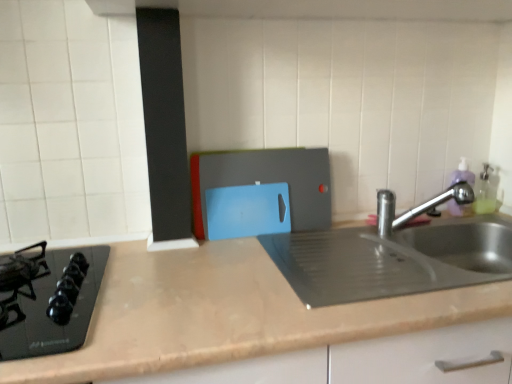
Question: Does blue plastic cutting board at center lie in front of black glass gas stove at left?

Choices:
 (A) no
 (B) yes

Answer: (A)

Question: From the image's perspective, does blue plastic cutting board at center appear higher than black glass gas stove at left?

Choices:
 (A) yes
 (B) no

Answer: (A)

Question: Is blue plastic cutting board at center not inside black glass gas stove at left?

Choices:
 (A) no
 (B) yes

Answer: (B)

Question: Is blue plastic cutting board at center smaller than black glass gas stove at left?

Choices:
 (A) yes
 (B) no

Answer: (A)

Question: Considering the relative sizes of blue plastic cutting board at center and black glass gas stove at left in the image provided, is blue plastic cutting board at center taller than black glass gas stove at left?

Choices:
 (A) no
 (B) yes

Answer: (B)

Question: In the image, is blue plastic cutting board at center positioned in front of or behind satin nickel faucet at right?

Choices:
 (A) behind
 (B) front

Answer: (A)

Question: From the image's perspective, is blue plastic cutting board at center positioned above or below satin nickel faucet at right?

Choices:
 (A) above
 (B) below

Answer: (A)

Question: Based on their positions, is blue plastic cutting board at center located to the left or right of satin nickel faucet at right?

Choices:
 (A) left
 (B) right

Answer: (A)

Question: Is blue plastic cutting board at center taller or shorter than satin nickel faucet at right?

Choices:
 (A) tall
 (B) short

Answer: (A)

Question: Does point (392, 195) appear closer or farther from the camera than point (14, 327)?

Choices:
 (A) farther
 (B) closer

Answer: (A)

Question: From their relative heights in the image, would you say satin nickel faucet at right is taller or shorter than black glass gas stove at left?

Choices:
 (A) tall
 (B) short

Answer: (A)

Question: Is satin nickel faucet at right spatially inside black glass gas stove at left, or outside of it?

Choices:
 (A) inside
 (B) outside

Answer: (B)

Question: From the image's perspective, is satin nickel faucet at right positioned above or below black glass gas stove at left?

Choices:
 (A) above
 (B) below

Answer: (A)

Question: In the image, is black glass gas stove at left positioned in front of or behind satin nickel faucet at right?

Choices:
 (A) behind
 (B) front

Answer: (B)

Question: Is point (0, 334) closer or farther from the camera than point (382, 221)?

Choices:
 (A) farther
 (B) closer

Answer: (B)